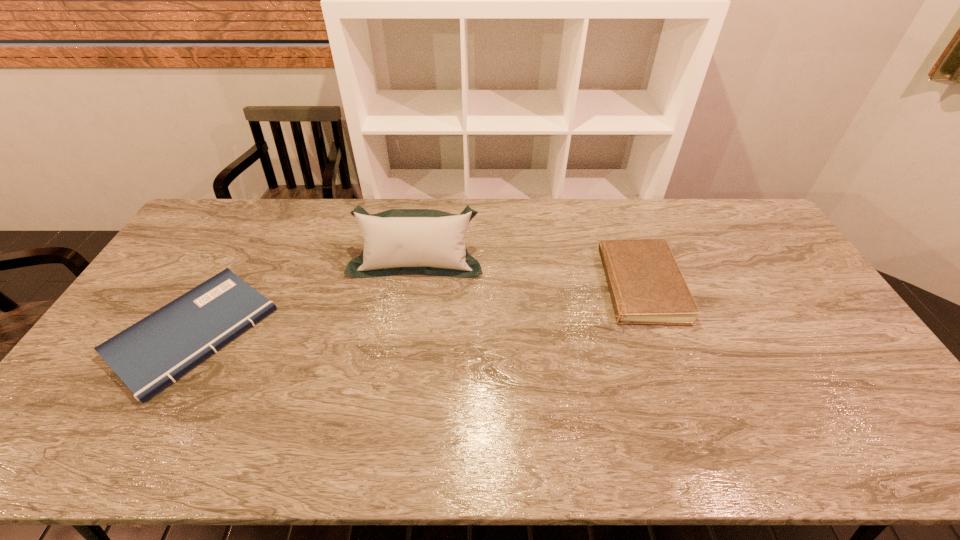
This screenshot has height=540, width=960. I want to click on the tallest object, so click(x=430, y=242).

The height and width of the screenshot is (540, 960). What are the coordinates of `cushion` in the screenshot? It's located at (430, 242).

Find the location of a particular element. This screenshot has width=960, height=540. the taller paperback book is located at coordinates (646, 285).

You are a GUI agent. You are given a task and a screenshot of the screen. Output one action in this format:
    pyautogui.click(x=<x>, y=<y>)
    Task: Click on the rightmost object
    The height and width of the screenshot is (540, 960).
    Given the screenshot: What is the action you would take?
    pyautogui.click(x=646, y=285)

Image resolution: width=960 pixels, height=540 pixels. What are the coordinates of `the left paperback book` in the screenshot? It's located at (148, 356).

At what (x,y) coordinates should I click in order to perform the action: click on the shorter paperback book. Please return your answer as a coordinate pair (x, y). The width and height of the screenshot is (960, 540). Looking at the image, I should click on (148, 356).

The width and height of the screenshot is (960, 540). In order to click on free location located on the surface of the cushion in this screenshot , I will do `click(400, 370)`.

Where is `vacant area situated on the spine side of the second shortest object`? This screenshot has width=960, height=540. vacant area situated on the spine side of the second shortest object is located at coordinates (483, 286).

This screenshot has height=540, width=960. Identify the location of free space located 0.260m on the spine side of the second shortest object. (499, 286).

I want to click on vacant region located 0.290m on the spine side of the second shortest object, so click(x=490, y=286).